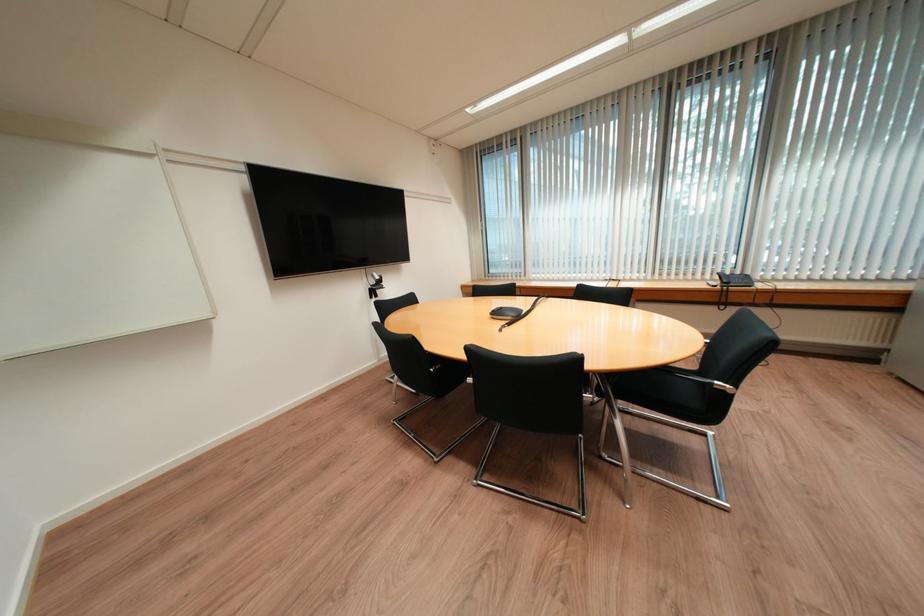
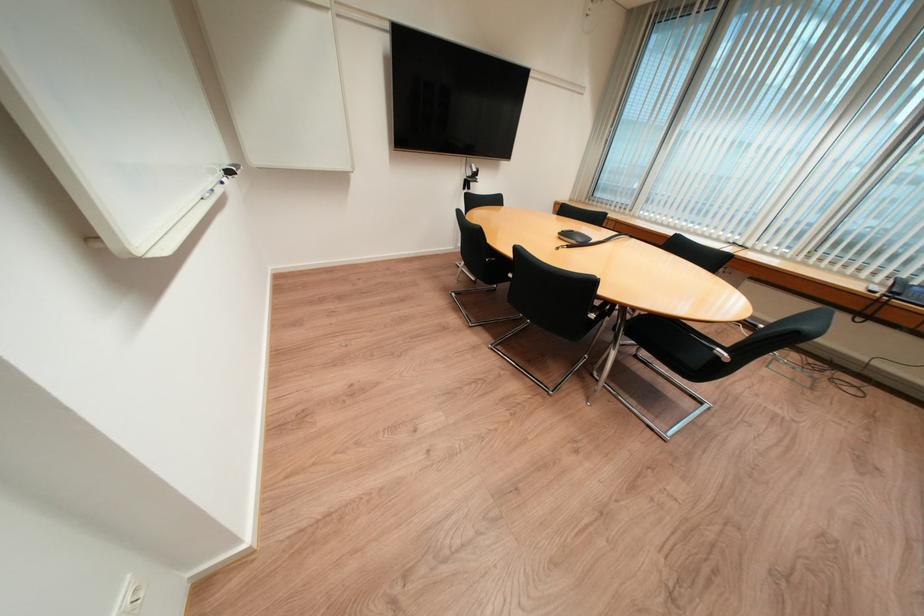
Locate, in the second image, the point that corresponds to pixel 732 392 in the first image.

(725, 359)